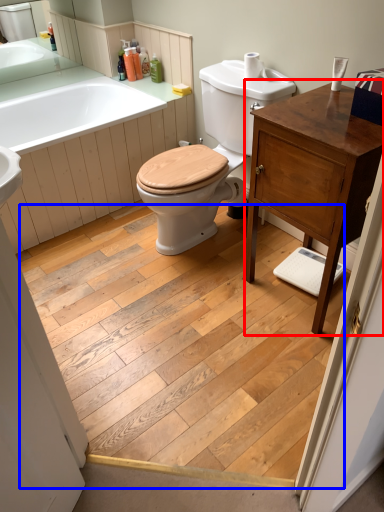
Question: Which object appears farthest to the camera in this image, bathroom cabinet (highlighted by a red box) or plank (highlighted by a blue box)?

Choices:
 (A) bathroom cabinet
 (B) plank

Answer: (A)